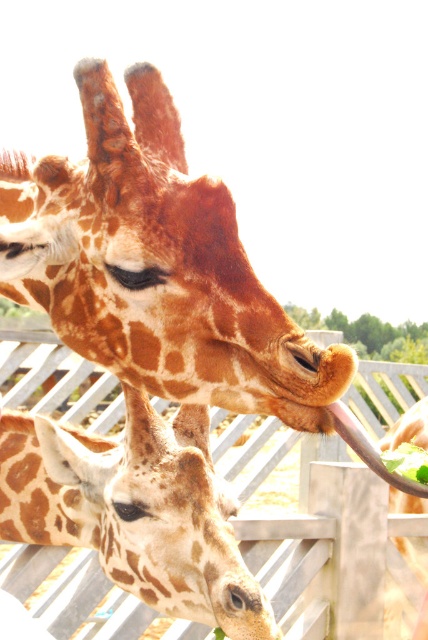
You are a zookeeper trying to feed the spotted fur giraffe at center. The green leafy food at lower right is placed near the fence. Can you estimate if the giraffe can reach the food with its neck?

The spotted fur giraffe at center might be wider than green leafy food at lower right, but the description does not provide information about the distance between them. Therefore, it is unclear if the giraffe can reach the food based on the given details.

You are a zookeeper observing the giraffes in their enclosure. You notice the spotted fur giraffe at center and the green leafy food at lower right. Based on their positions, can the giraffe reach the food without moving its head?

The green leafy food at lower right is behind the spotted fur giraffe at center, so the giraffe cannot reach it without moving its head since the food is positioned behind it.